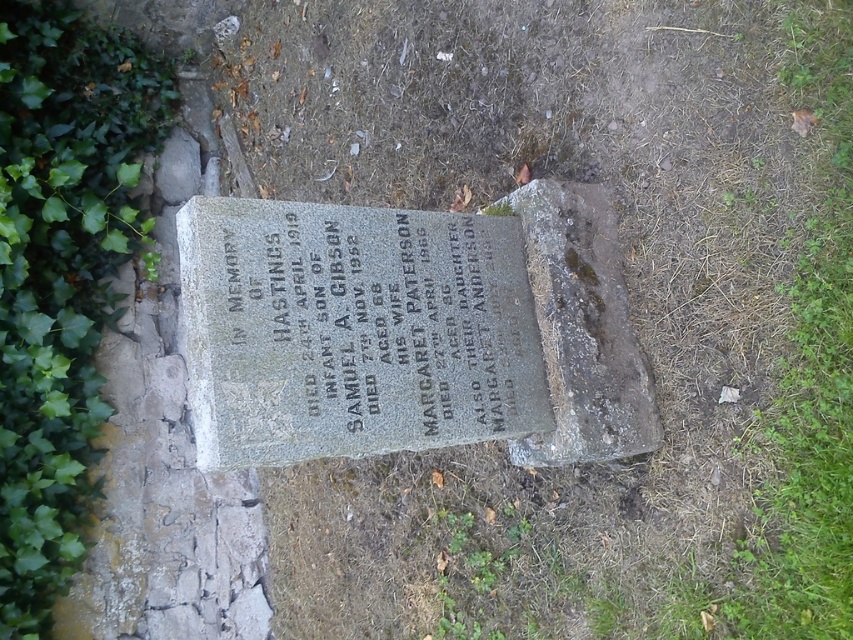
Between point (349, 356) and point (47, 211), which one is positioned in front?

Point (349, 356) is more forward.

Locate an element on the screen. This screenshot has height=640, width=853. granite inscription at center is located at coordinates (368, 326).